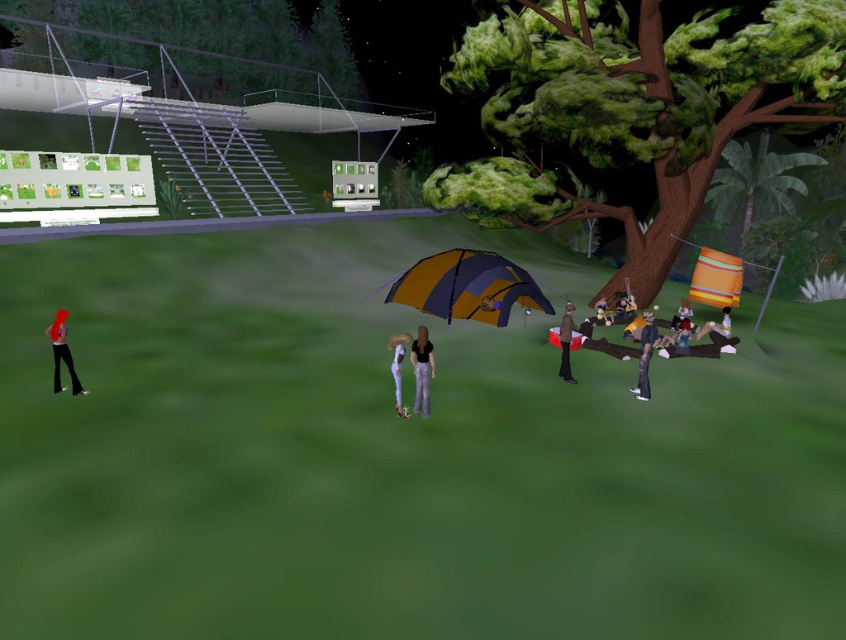
Question: Does denim jeans at lower right appear on the left side of matte yellow shirt at lower right?

Choices:
 (A) no
 (B) yes

Answer: (B)

Question: In this image, where is denim jeans at lower right located relative to matte yellow shirt at lower right?

Choices:
 (A) right
 (B) left

Answer: (B)

Question: Which of these objects is positioned farthest from the orange fabric bag at center right?

Choices:
 (A) green matte tree at center right
 (B) matte yellow shirt at lower right

Answer: (A)

Question: Which object appears farthest from the camera in this image?

Choices:
 (A) orange fabric bag at center right
 (B) black matte pants at center
 (C) green leafy tree at upper center

Answer: (C)

Question: Which object is positioned closest to the black matte pants at center?

Choices:
 (A) white matte pants at center
 (B) orange fabric bag at center right
 (C) matte black pants at center

Answer: (A)

Question: In this image, where is green matte tree at center right located relative to matte black pants at center?

Choices:
 (A) above
 (B) below

Answer: (A)